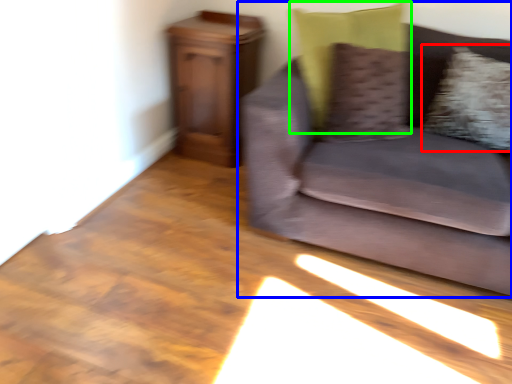
Question: Which is nearer to the pillow (highlighted by a red box)? studio couch (highlighted by a blue box) or pillow (highlighted by a green box).

Choices:
 (A) studio couch
 (B) pillow

Answer: (A)